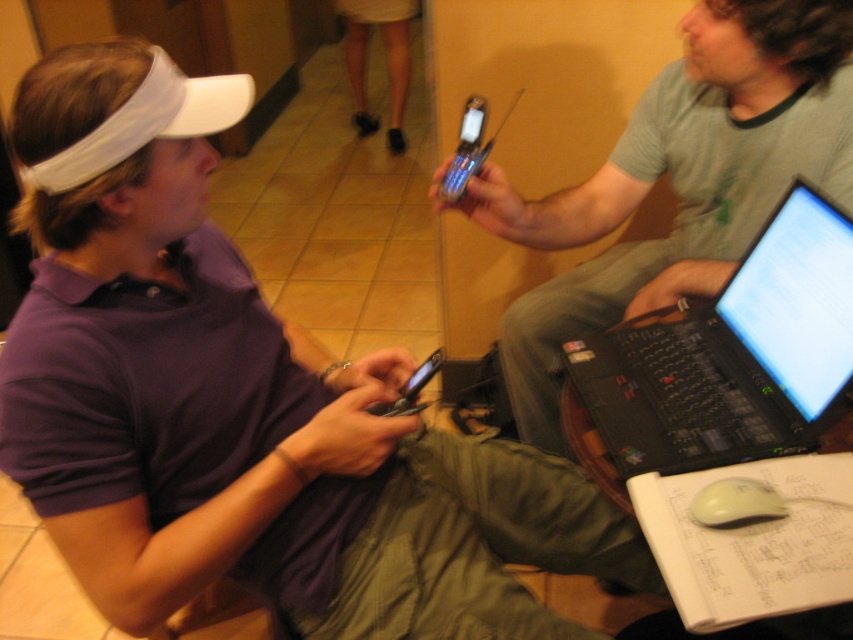
Question: Estimate the real-world distances between objects in this image. Which object is farther from the light beige skirt at upper center?

Choices:
 (A) white matte mouse at lower right
 (B) silver metallic phone at center
 (C) matte black laptop at center

Answer: (A)

Question: Is purple matte shirt at center wider than black plastic laptop at right?

Choices:
 (A) no
 (B) yes

Answer: (B)

Question: Which point appears closest to the camera in this image?

Choices:
 (A) (730, 516)
 (B) (744, 262)
 (C) (402, 404)
 (D) (55, 285)

Answer: (D)

Question: Is black plastic laptop at right positioned in front of black glossy smartphone at center?

Choices:
 (A) yes
 (B) no

Answer: (A)

Question: Which point is closer to the camera taking this photo?

Choices:
 (A) (810, 308)
 (B) (437, 193)

Answer: (A)

Question: Is light beige skirt at upper center below silver metallic phone at center?

Choices:
 (A) yes
 (B) no

Answer: (B)